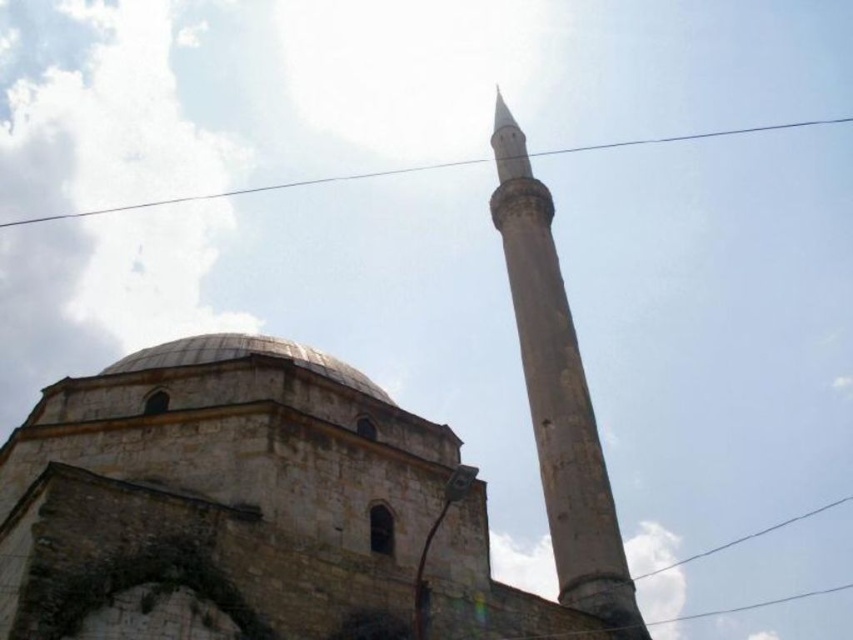
Question: From the image, what is the correct spatial relationship of gray stone dome at center in relation to clear wire at upper center?

Choices:
 (A) below
 (B) above

Answer: (A)

Question: Which point is closer to the camera?

Choices:
 (A) smooth stone minaret at center
 (B) gray stone dome at center
 (C) clear wire at upper center

Answer: (B)

Question: Is the position of smooth stone minaret at center less distant than that of gray stone dome at center?

Choices:
 (A) no
 (B) yes

Answer: (A)

Question: Does smooth stone minaret at center have a greater width compared to clear wire at upper center?

Choices:
 (A) no
 (B) yes

Answer: (A)

Question: Which object is the farthest from the smooth stone minaret at center?

Choices:
 (A) gray stone dome at center
 (B) clear wire at upper center

Answer: (B)

Question: Among these points, which one is nearest to the camera?

Choices:
 (A) (505, 220)
 (B) (148, 348)

Answer: (B)